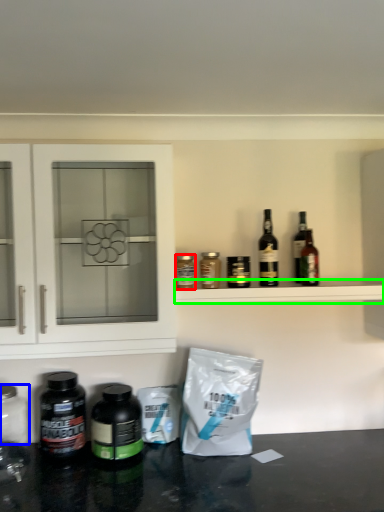
Question: Which is farther away from bottle (highlighted by a red box)? glass jar (highlighted by a blue box) or shelf (highlighted by a green box)?

Choices:
 (A) glass jar
 (B) shelf

Answer: (A)